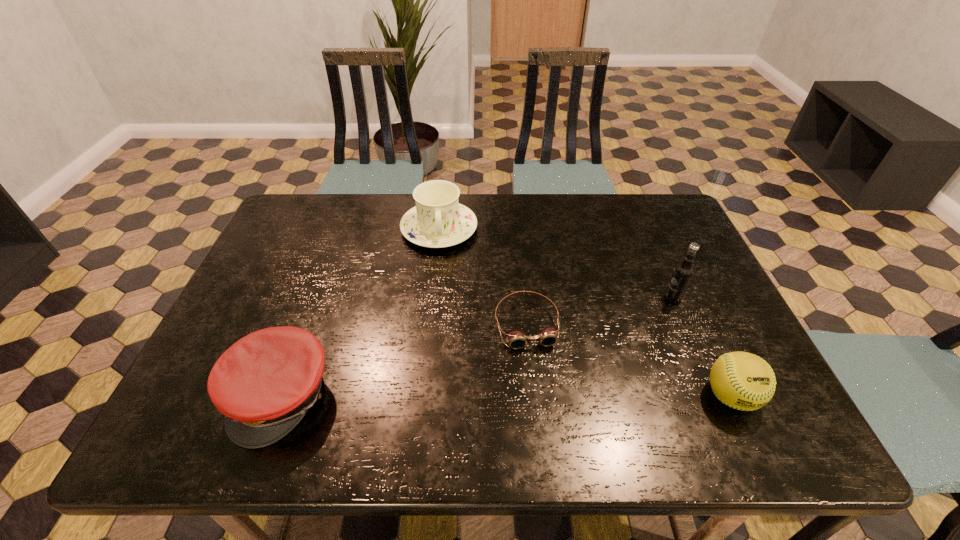
Where is `vacant area situated 0.060m through the lenses of the shortest object`? The height and width of the screenshot is (540, 960). vacant area situated 0.060m through the lenses of the shortest object is located at coordinates (538, 374).

Image resolution: width=960 pixels, height=540 pixels. Identify the location of free space located through the lenses of the shortest object. (545, 406).

I want to click on free space located 0.130m through the lenses of the shortest object, so click(544, 401).

You are a GUI agent. You are given a task and a screenshot of the screen. Output one action in this format:
    pyautogui.click(x=<x>, y=<y>)
    Task: Click on the vacant space positioned on the label of the root beer
    This screenshot has height=540, width=960.
    Given the screenshot: What is the action you would take?
    pyautogui.click(x=548, y=364)

In order to click on vacant point located on the label of the root beer in this screenshot , I will do `click(654, 307)`.

Find the location of `vacant area situated 0.270m on the label of the root beer`. vacant area situated 0.270m on the label of the root beer is located at coordinates (588, 343).

Locate an element on the screen. The height and width of the screenshot is (540, 960). object present at the far edge is located at coordinates (438, 220).

At what (x,y) coordinates should I click in order to perform the action: click on cap at the near edge. Please return your answer as a coordinate pair (x, y). This screenshot has width=960, height=540. Looking at the image, I should click on (264, 384).

Locate an element on the screen. softball that is at the near edge is located at coordinates (741, 380).

This screenshot has height=540, width=960. In order to click on object present at the left edge in this screenshot , I will do [x=264, y=384].